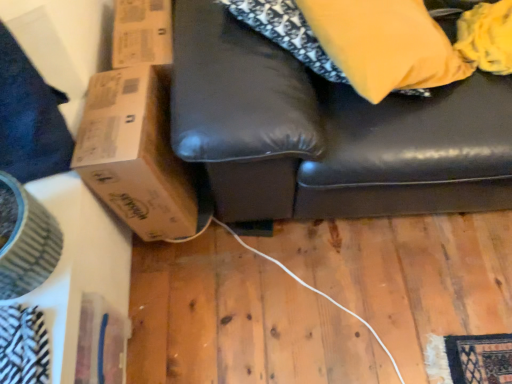
Question: Is brown cardboard box at left in front of or behind matte yellow pillow at upper right in the image?

Choices:
 (A) behind
 (B) front

Answer: (A)

Question: From a real-world perspective, is brown cardboard box at left positioned above or below matte yellow pillow at upper right?

Choices:
 (A) below
 (B) above

Answer: (A)

Question: Which is farther from the brown cardboard box at left?

Choices:
 (A) matte yellow pillow at upper right
 (B) wooden floor at lower center

Answer: (A)

Question: Estimate the real-world distances between objects in this image. Which object is closer to the brown cardboard box at left?

Choices:
 (A) wooden floor at lower center
 (B) matte yellow pillow at upper right

Answer: (A)